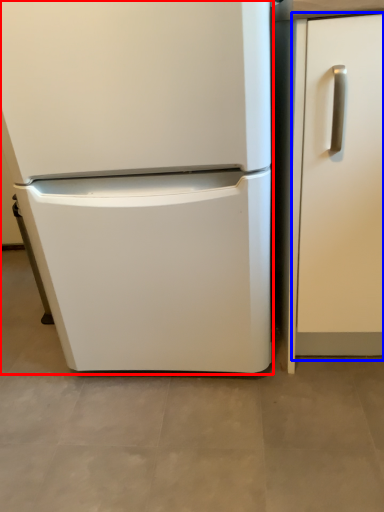
Question: Among these objects, which one is nearest to the camera, refrigerator (highlighted by a red box) or door (highlighted by a blue box)?

Choices:
 (A) refrigerator
 (B) door

Answer: (A)